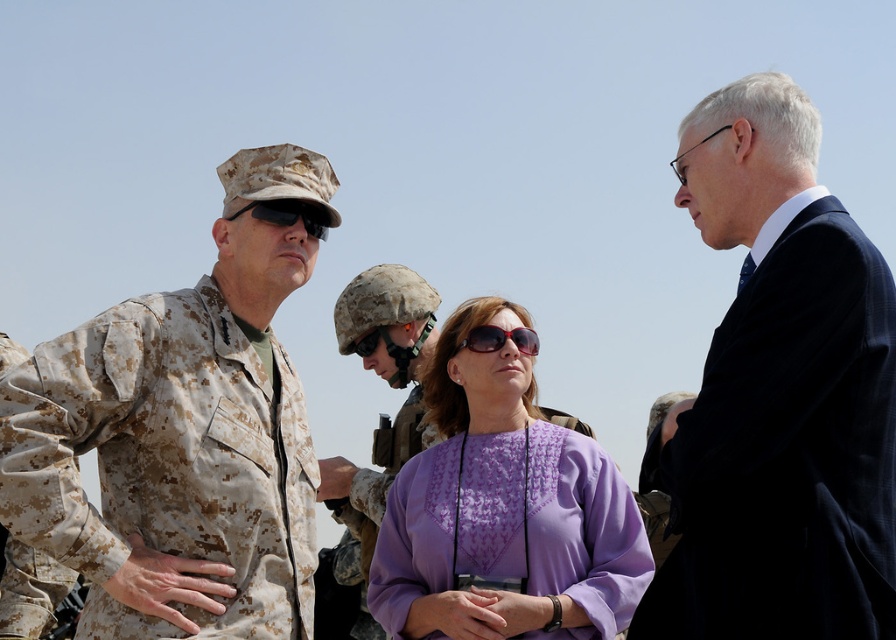
Question: Which point appears closest to the camera in this image?

Choices:
 (A) (308, 208)
 (B) (616, 618)
 (C) (853, 228)

Answer: (C)

Question: Which point is closer to the camera?

Choices:
 (A) translucent plastic sunglasses at center
 (B) camouflage uniform at left
 (C) purple fabric blouse at center

Answer: (B)

Question: Does camouflage uniform at left have a lesser width compared to purple fabric blouse at center?

Choices:
 (A) no
 (B) yes

Answer: (B)

Question: Can you confirm if purple fabric blouse at center is positioned above matte black sunglasses at upper center?

Choices:
 (A) yes
 (B) no

Answer: (B)

Question: Can you confirm if dark blue suit at right is positioned to the right of purple fabric blouse at center?

Choices:
 (A) yes
 (B) no

Answer: (A)

Question: Which point is farther to the camera?

Choices:
 (A) translucent plastic sunglasses at center
 (B) purple fabric blouse at center
 (C) matte black sunglasses at upper center
 (D) dark blue suit at right

Answer: (A)